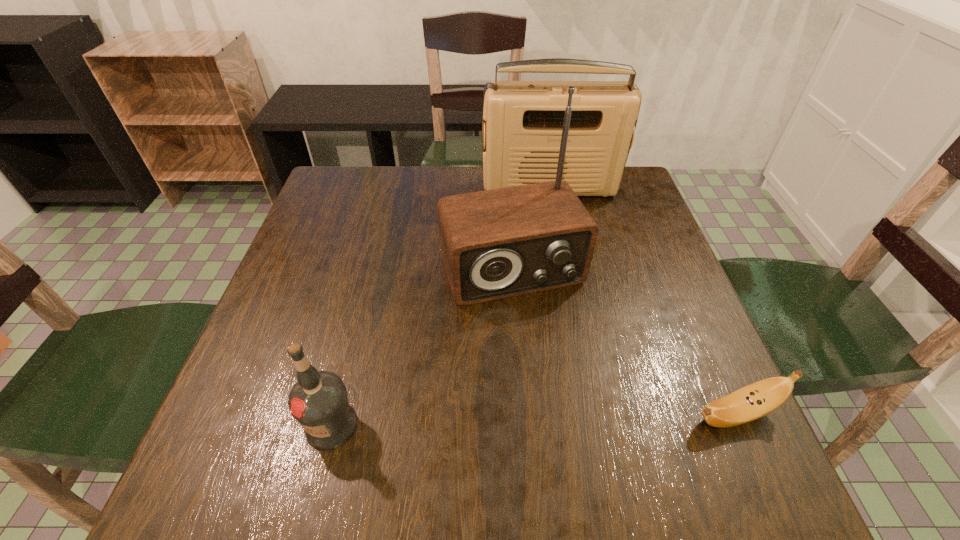
At what (x,y) coordinates should I click in order to perform the action: click on free space that is in between the nearer radio receiver and the leftmost object. Please return your answer as a coordinate pair (x, y). Image resolution: width=960 pixels, height=540 pixels. Looking at the image, I should click on (421, 347).

Image resolution: width=960 pixels, height=540 pixels. Identify the location of unoccupied position between the leftmost object and the shortest object. (534, 420).

Where is `object that is the third closest to the leftmost object`? Image resolution: width=960 pixels, height=540 pixels. object that is the third closest to the leftmost object is located at coordinates (524, 120).

Identify the location of object that can be found as the closest to the vodka. (499, 243).